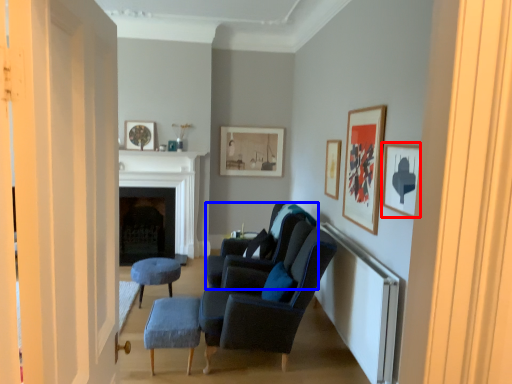
Question: Among these objects, which one is nearest to the camera, picture frame (highlighted by a red box) or chair (highlighted by a blue box)?

Choices:
 (A) picture frame
 (B) chair

Answer: (A)